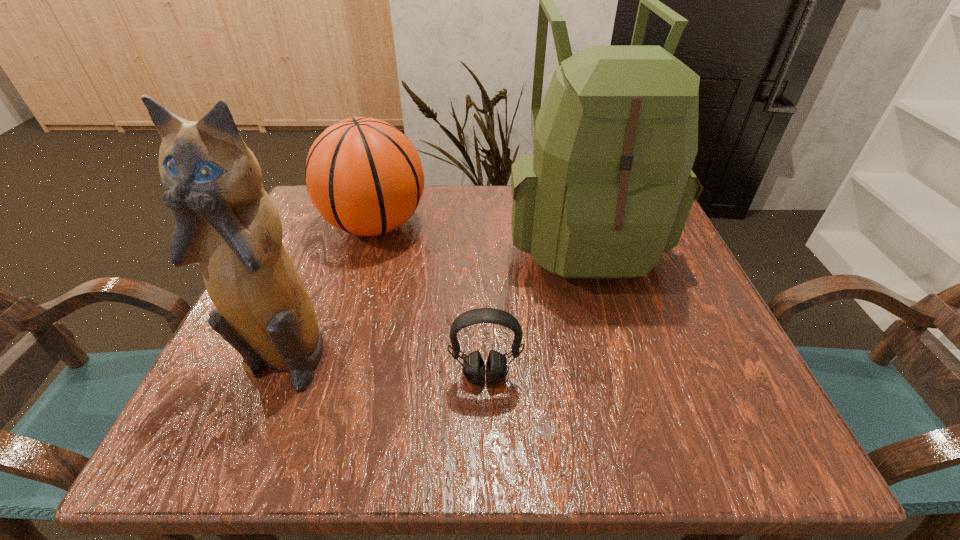
Find the location of a particular element. Image resolution: width=960 pixels, height=540 pixels. the second closest object to the backpack is located at coordinates (364, 176).

I want to click on object that is the third closest one to the cat, so click(608, 189).